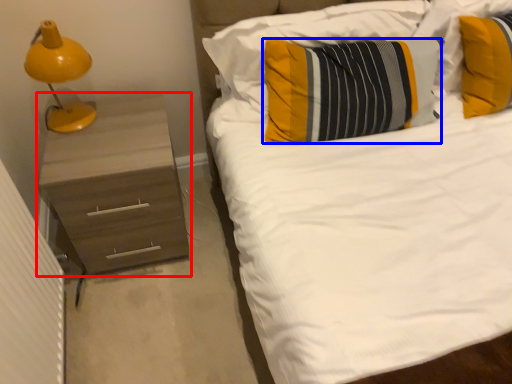
Question: Which point is closer to the camera, chest of drawers (highlighted by a red box) or pillow (highlighted by a blue box)?

Choices:
 (A) chest of drawers
 (B) pillow

Answer: (B)